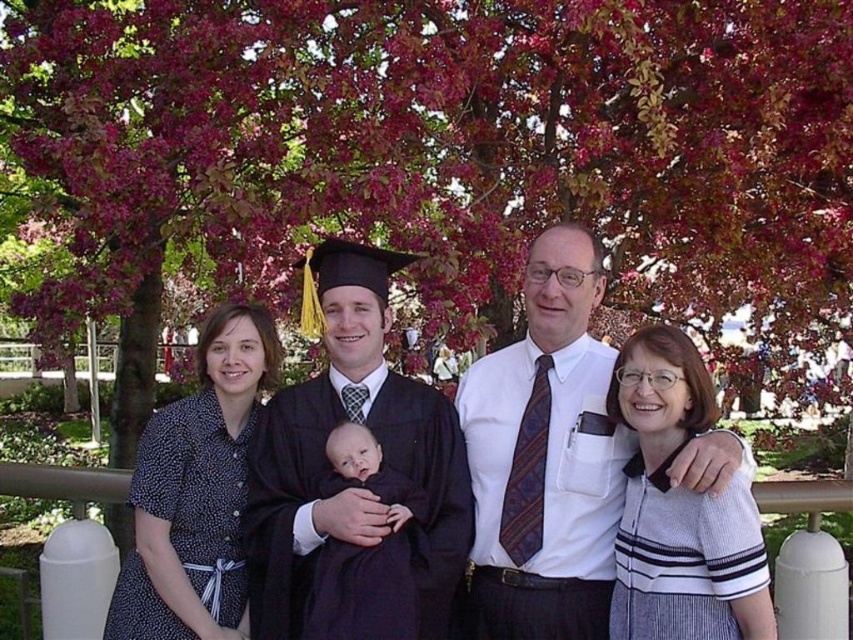
You are a photographer trying to fit all five people in the frame. The matte black graduation gown at center and the smooth dark fabric baby at center are the two largest objects in the scene. Which one takes up more space in the photo?

The matte black graduation gown at center is larger in size than the smooth dark fabric baby at center, so it takes up more space in the photo.